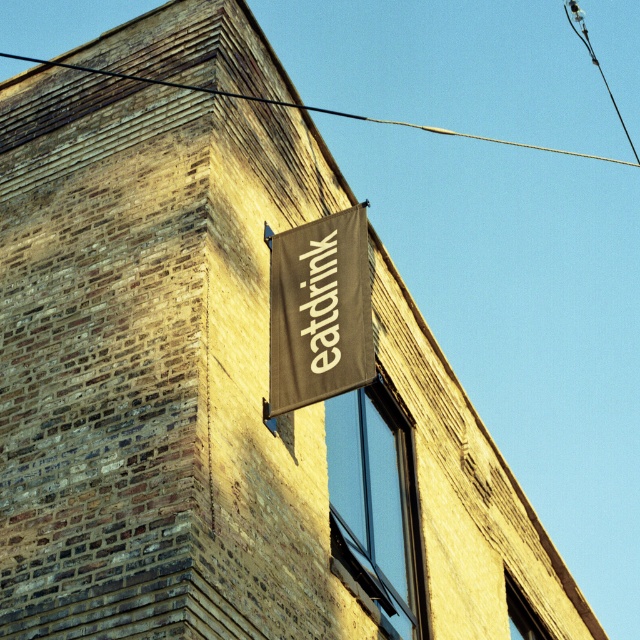
Does point (365, 230) come farther from viewer compared to point (413, 124)?

No, (365, 230) is closer to viewer.

Between point (285, 380) and point (301, 108), which one is positioned in front?

Point (285, 380)

Where is `brown canvas sign at upper center`? Image resolution: width=640 pixels, height=640 pixels. brown canvas sign at upper center is located at coordinates (320, 310).